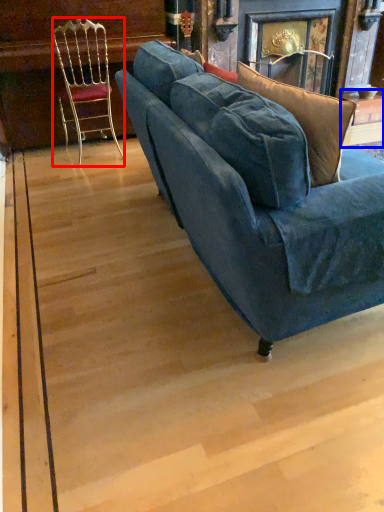
Question: Which of the following is the farthest to the observer, chair (highlighted by a red box) or table (highlighted by a blue box)?

Choices:
 (A) chair
 (B) table

Answer: (B)